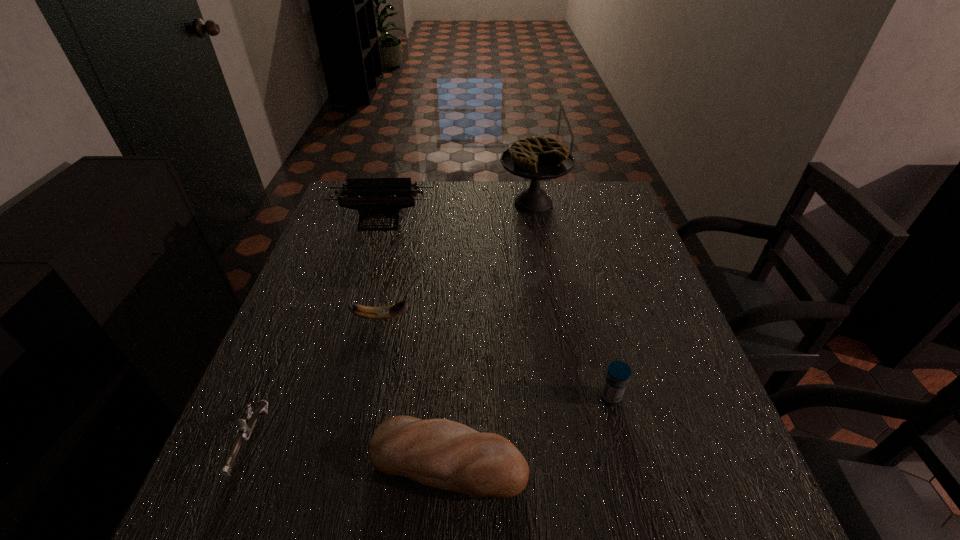
The width and height of the screenshot is (960, 540). Identify the location of vacant position in the image that satisfies the following two spatial constraints: 1. on the peel of the third farthest object; 2. aimed along the barrel of the gun. (353, 442).

Locate an element on the screen. The width and height of the screenshot is (960, 540). free space that satisfies the following two spatial constraints: 1. on the cut side of the pie; 2. on the peel of the banana is located at coordinates (552, 318).

The width and height of the screenshot is (960, 540). Identify the location of free space that satisfies the following two spatial constraints: 1. on the peel of the banana; 2. aimed along the barrel of the gun. (353, 442).